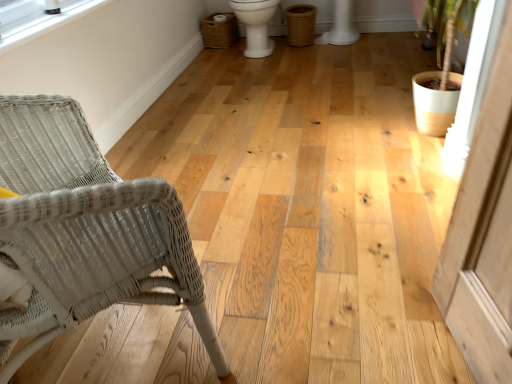
Find the location of `vacant space in front of woven brown laundry basket at upper center`. vacant space in front of woven brown laundry basket at upper center is located at coordinates (217, 56).